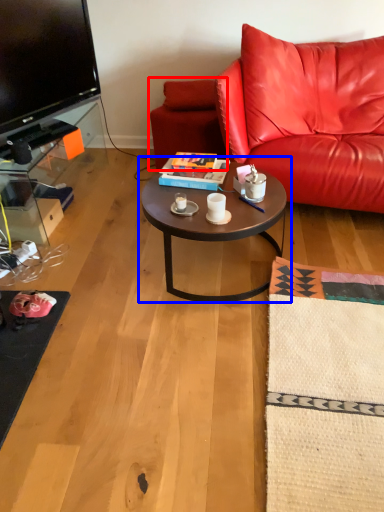
Question: Which object is further to the camera taking this photo, swivel chair (highlighted by a red box) or coffee table (highlighted by a blue box)?

Choices:
 (A) swivel chair
 (B) coffee table

Answer: (A)